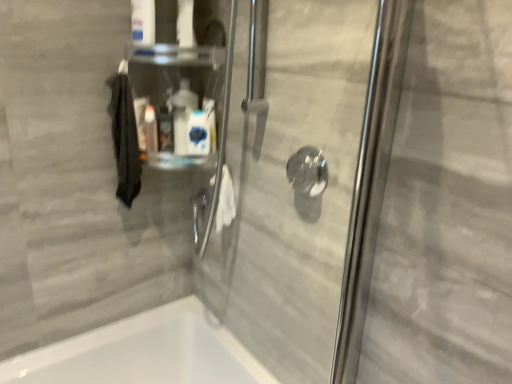
Question: Is white glossy bottle at center, which is the second cleaning product from left to right, outside of clear plastic container at upper center?

Choices:
 (A) no
 (B) yes

Answer: (A)

Question: Can you confirm if white glossy bottle at center, which is the second cleaning product from left to right, is positioned to the left of clear plastic container at upper center?

Choices:
 (A) yes
 (B) no

Answer: (B)

Question: Considering the relative sizes of white glossy bottle at center, which is the second cleaning product from left to right, and clear plastic container at upper center in the image provided, is white glossy bottle at center, which is the second cleaning product from left to right, smaller than clear plastic container at upper center?

Choices:
 (A) no
 (B) yes

Answer: (B)

Question: Would you say white glossy bottle at center, the first cleaning product when ordered from right to left, contains clear plastic container at upper center?

Choices:
 (A) yes
 (B) no

Answer: (B)

Question: Are white glossy bottle at center, which is the second cleaning product from left to right, and clear plastic container at upper center located far from each other?

Choices:
 (A) no
 (B) yes

Answer: (A)

Question: From a real-world perspective, does white glossy bottle at center, which is the second cleaning product from left to right, sit lower than clear plastic container at upper center?

Choices:
 (A) yes
 (B) no

Answer: (A)

Question: Is white glossy bottle at center, which is the second cleaning product from left to right, completely or partially outside of transparent glass shower handle at center?

Choices:
 (A) no
 (B) yes

Answer: (B)

Question: Does white glossy bottle at center, which is the second cleaning product from left to right, lie in front of transparent glass shower handle at center?

Choices:
 (A) no
 (B) yes

Answer: (A)

Question: From the image's perspective, would you say white glossy bottle at center, which is the second cleaning product from left to right, is positioned over transparent glass shower handle at center?

Choices:
 (A) yes
 (B) no

Answer: (A)

Question: Are white glossy bottle at center, the first cleaning product when ordered from right to left, and transparent glass shower handle at center located far from each other?

Choices:
 (A) no
 (B) yes

Answer: (A)

Question: Does white glossy bottle at center, which is the second cleaning product from left to right, have a greater width compared to transparent glass shower handle at center?

Choices:
 (A) no
 (B) yes

Answer: (A)

Question: Is white glossy bottle at center, the first cleaning product when ordered from right to left, positioned with its back to transparent glass shower handle at center?

Choices:
 (A) no
 (B) yes

Answer: (A)

Question: Does white glossy bottle at upper center, which ranks as the first cleaning product in left-to-right order, come behind transparent glass shower handle at center?

Choices:
 (A) yes
 (B) no

Answer: (A)